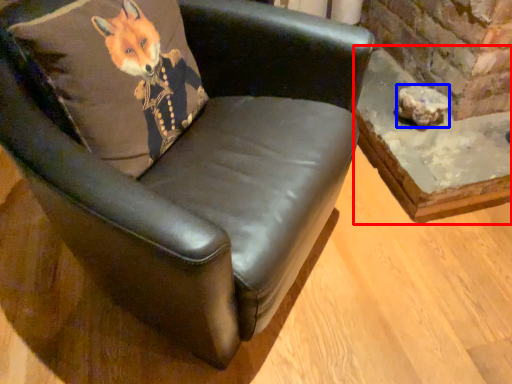
Question: Among these objects, which one is nearest to the camera, table (highlighted by a red box) or stone (highlighted by a blue box)?

Choices:
 (A) table
 (B) stone

Answer: (A)